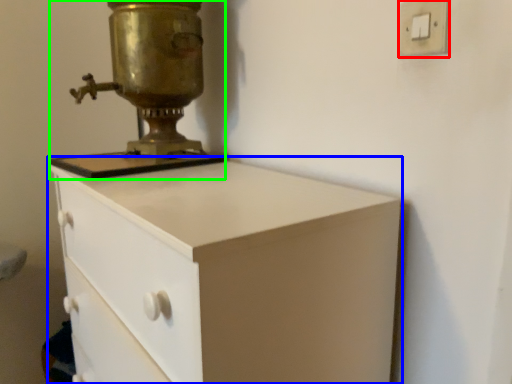
Question: Which object is the farthest from light switch (highlighted by a red box)? Choose among these: chest of drawers (highlighted by a blue box) or sewing machine (highlighted by a green box).

Choices:
 (A) chest of drawers
 (B) sewing machine

Answer: (B)